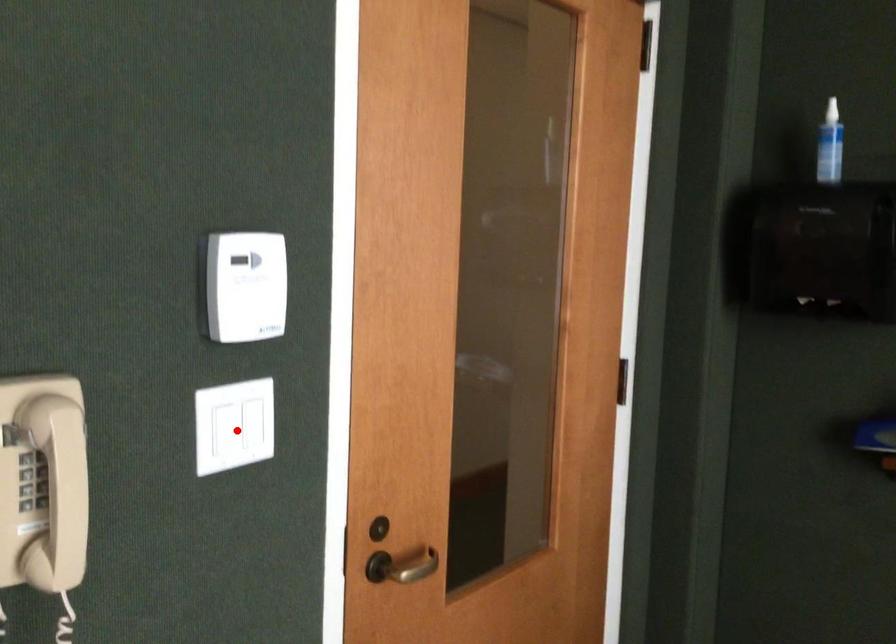
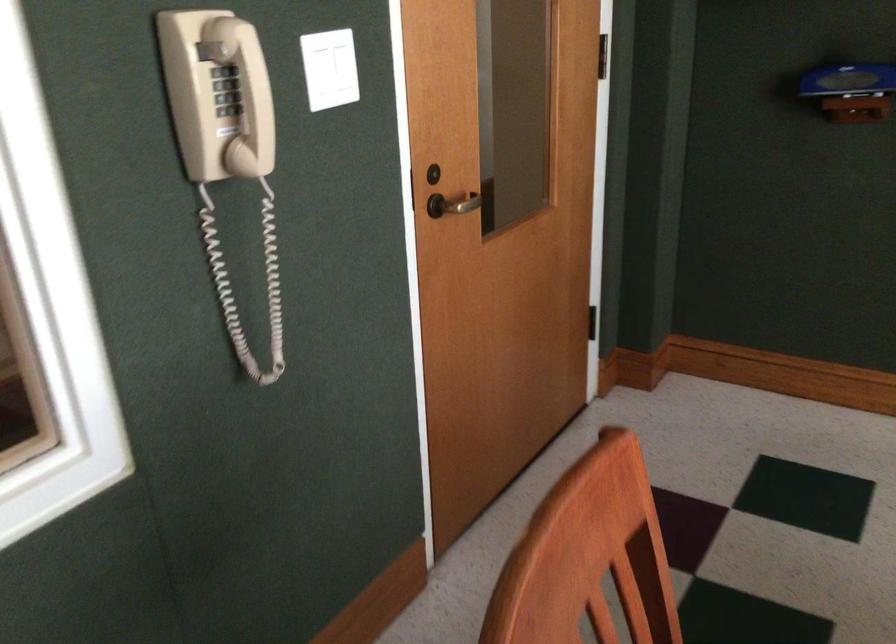
Question: I am providing you with two images of the same scene from different viewpoints. Given a red point in image1, look at the same physical point in image2. Is it:

Choices:
 (A) Closer to the viewpoint
 (B) Farther from the viewpoint

Answer: (B)